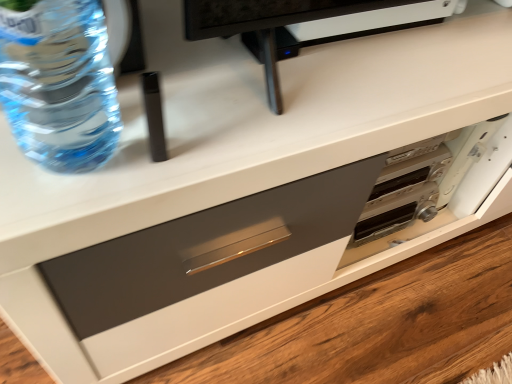
Question: Considering the positions of translucent plastic bottle at upper left and matte gray drawer at center in the image, is translucent plastic bottle at upper left bigger or smaller than matte gray drawer at center?

Choices:
 (A) small
 (B) big

Answer: (A)

Question: Based on their positions, is translucent plastic bottle at upper left located to the left or right of matte gray drawer at center?

Choices:
 (A) right
 (B) left

Answer: (B)

Question: Looking at their shapes, would you say translucent plastic bottle at upper left is wider or thinner than matte gray drawer at center?

Choices:
 (A) thin
 (B) wide

Answer: (A)

Question: From the image's perspective, is matte gray drawer at center positioned above or below translucent plastic bottle at upper left?

Choices:
 (A) below
 (B) above

Answer: (A)

Question: Is matte gray drawer at center taller or shorter than translucent plastic bottle at upper left?

Choices:
 (A) tall
 (B) short

Answer: (B)

Question: From a real-world perspective, is matte gray drawer at center positioned above or below translucent plastic bottle at upper left?

Choices:
 (A) below
 (B) above

Answer: (A)

Question: Considering the positions of matte gray drawer at center and translucent plastic bottle at upper left in the image, is matte gray drawer at center bigger or smaller than translucent plastic bottle at upper left?

Choices:
 (A) big
 (B) small

Answer: (A)